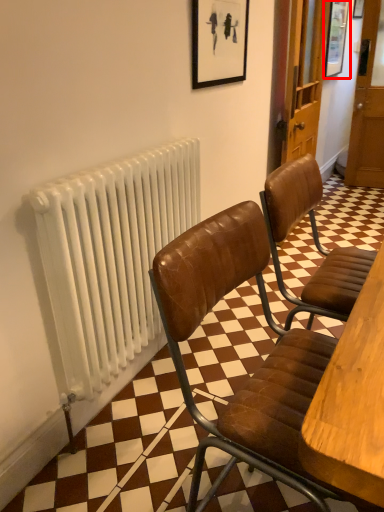
Question: Considering the relative positions of picture frame (annotated by the red box) and radiator in the image provided, where is picture frame (annotated by the red box) located with respect to the staircase?

Choices:
 (A) left
 (B) right

Answer: (B)